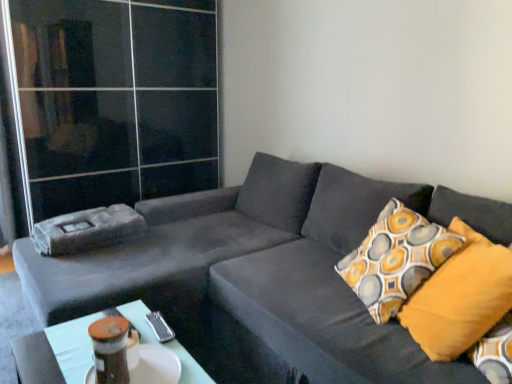
Image resolution: width=512 pixels, height=384 pixels. In order to click on empty space that is ontop of matte plastic table at lower center in this screenshot , I will do `click(130, 347)`.